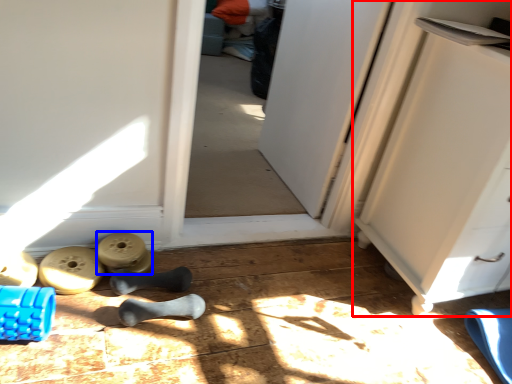
Question: Which point is further to the camera, cabinetry (highlighted by a red box) or job (highlighted by a blue box)?

Choices:
 (A) cabinetry
 (B) job

Answer: (B)